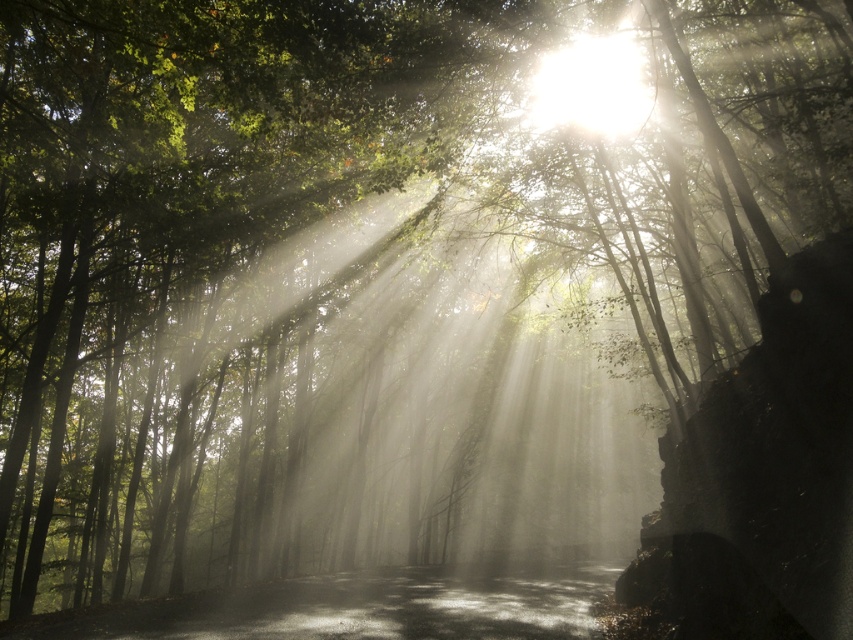
You are a hiker trying to determine the best path through the forest. You notice a shiny asphalt road at center and a bright white light at upper center. Which of these two features is wider?

The shiny asphalt road at center is wider than the bright white light at upper center, as its width surpasses the latter.

You are standing at the edge of a forest and see the shiny asphalt road at center. If you want to reach the road, which direction should you walk towards?

You should walk towards the center of the forest to reach the shiny asphalt road at center, as it is located at point coordinates of (350, 609).